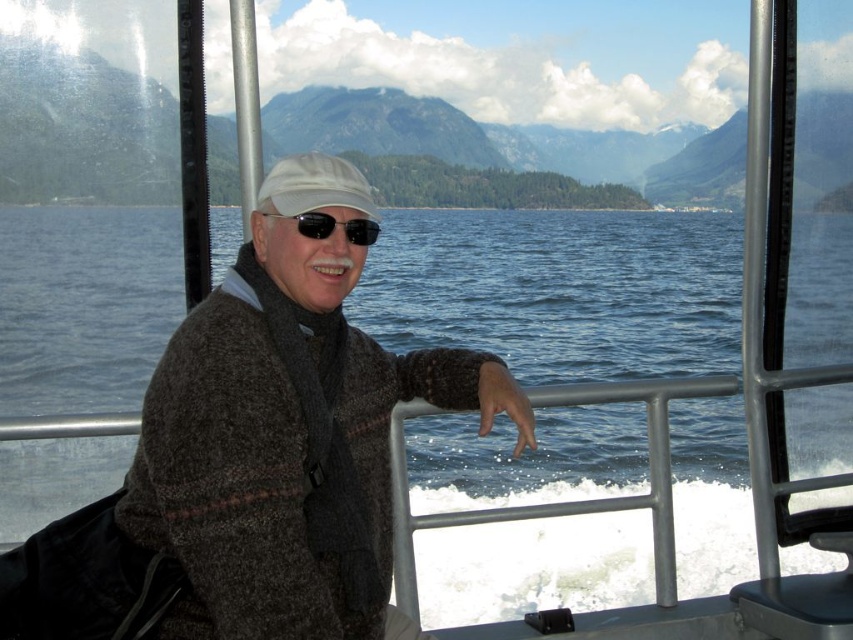
You are a photographer trying to capture the person on the boat. You notice the white matte cap at center and the black reflective sunglasses at center. Which object should you focus on if you want to capture the larger one in your shot?

The white matte cap at center is larger in size than the black reflective sunglasses at center, so you should focus on the white matte cap at center to capture the larger one in your shot.

In the scene shown: You are standing on the boat and want to reach the point marked as point (236, 572). If your walking speed is 1.5 meters per second, how long will it take you to reach that point?

The distance of point (236, 572) from camera is 5.27 meters. At a speed of 1.5 meters per second, it would take approximately 3.51 seconds to reach the point.